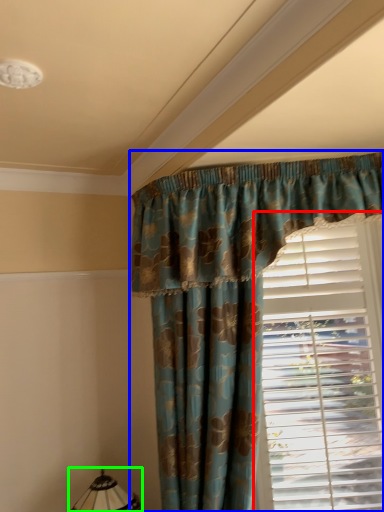
Question: Which is farther away from window blind (highlighted by a red box)? curtain (highlighted by a blue box) or table lamp (highlighted by a green box)?

Choices:
 (A) curtain
 (B) table lamp

Answer: (B)